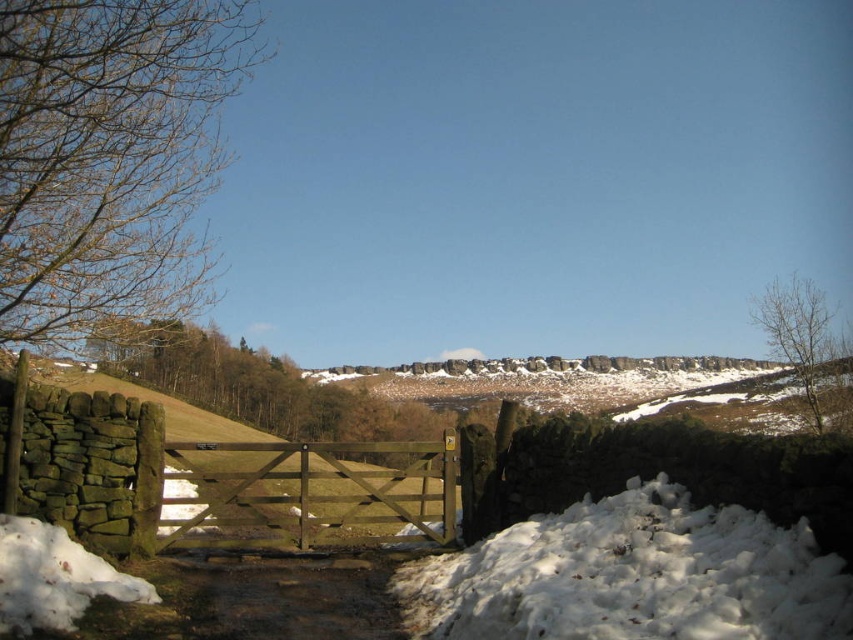
Between bare branches at upper left and brown wooden gate at center, which one appears on the left side from the viewer's perspective?

bare branches at upper left is more to the left.

Is bare branches at upper left bigger than brown wooden gate at center?

No.

Is point (167, 252) closer to viewer compared to point (242, 541)?

No.

You are a GUI agent. You are given a task and a screenshot of the screen. Output one action in this format:
    pyautogui.click(x=<x>, y=<y>)
    Task: Click on the bare branches at upper left
    
    Given the screenshot: What is the action you would take?
    pyautogui.click(x=108, y=157)

Does wooden gate at center have a greater width compared to brown wooden gate at center?

No.

This screenshot has width=853, height=640. What do you see at coordinates (251, 480) in the screenshot?
I see `wooden gate at center` at bounding box center [251, 480].

Is point (163, 435) farther from viewer compared to point (451, 525)?

No, it is not.

The image size is (853, 640). I want to click on wooden gate at center, so click(251, 480).

What do you see at coordinates (631, 577) in the screenshot? I see `white fluffy snow at lower right` at bounding box center [631, 577].

Is white fluffy snow at lower right above bare wood tree at upper right?

No, white fluffy snow at lower right is not above bare wood tree at upper right.

What do you see at coordinates (631, 577) in the screenshot? The height and width of the screenshot is (640, 853). I see `white fluffy snow at lower right` at bounding box center [631, 577].

Identify the location of white fluffy snow at lower right. (631, 577).